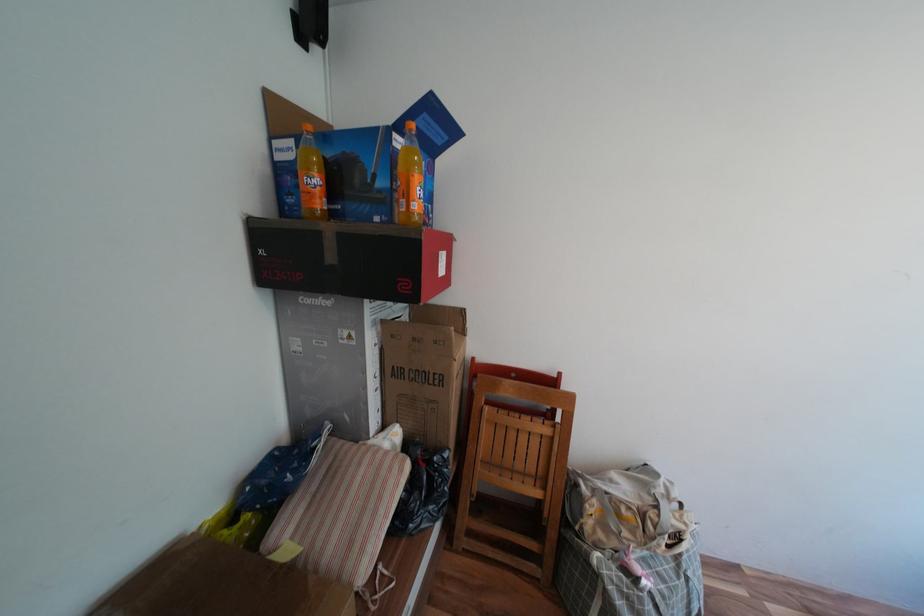
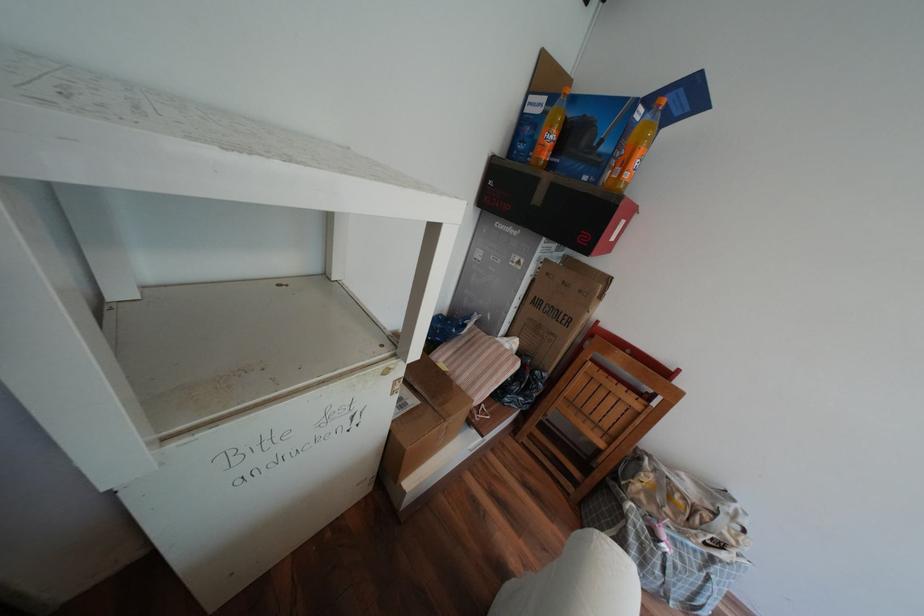
Locate, in the second image, the point that corresponds to pixel 444 342 in the first image.

(590, 291)